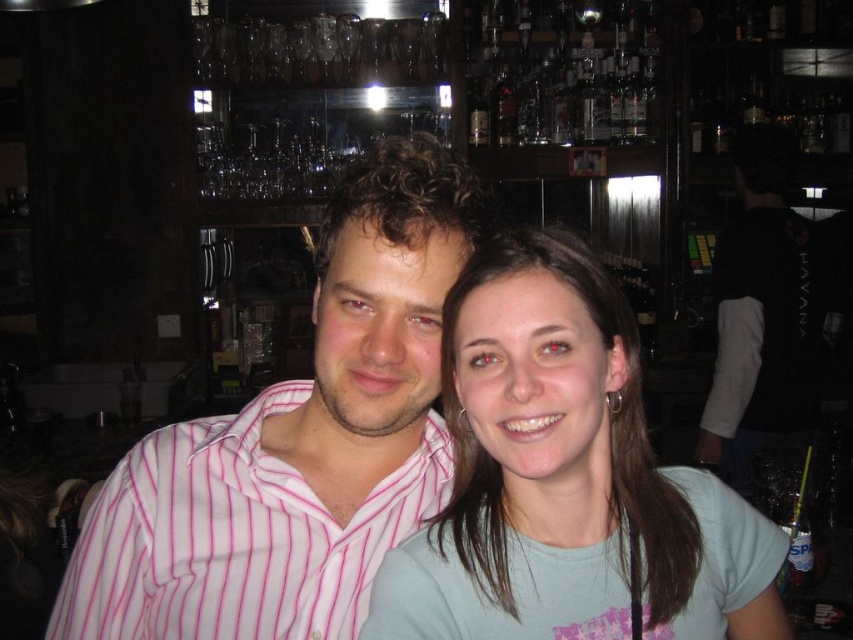
Question: Is pink striped shirt at center bigger than pink striped shirt at left?

Choices:
 (A) no
 (B) yes

Answer: (B)

Question: Can you confirm if pink striped shirt at center is positioned below light blue cotton shirt at center?

Choices:
 (A) no
 (B) yes

Answer: (A)

Question: Which object is the closest to the pink striped shirt at left?

Choices:
 (A) pink striped shirt at center
 (B) light blue cotton shirt at center

Answer: (A)

Question: Among these objects, which one is farthest from the camera?

Choices:
 (A) pink striped shirt at center
 (B) pink striped shirt at left

Answer: (B)

Question: Which object is the closest to the light blue cotton shirt at center?

Choices:
 (A) pink striped shirt at center
 (B) pink striped shirt at left

Answer: (A)

Question: Is pink striped shirt at center closer to the viewer compared to pink striped shirt at left?

Choices:
 (A) no
 (B) yes

Answer: (B)